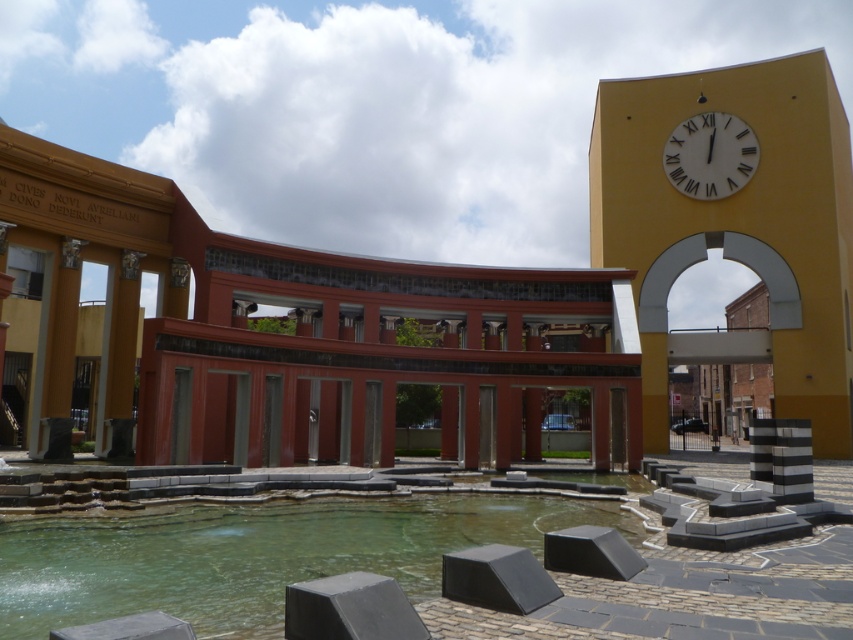
Which is more to the left, yellow matte clock tower at upper right or white matte clock at upper right?

Positioned to the left is white matte clock at upper right.

How far apart are yellow matte clock tower at upper right and white matte clock at upper right?

The distance of yellow matte clock tower at upper right from white matte clock at upper right is 8.74 feet.

What do you see at coordinates (734, 224) in the screenshot? I see `yellow matte clock tower at upper right` at bounding box center [734, 224].

Where is `yellow matte clock tower at upper right`? The width and height of the screenshot is (853, 640). yellow matte clock tower at upper right is located at coordinates (734, 224).

At what (x,y) coordinates should I click in order to perform the action: click on clear glass water at center. Please return your answer as a coordinate pair (x, y). Looking at the image, I should click on (253, 554).

Between clear glass water at center and white matte clock at upper right, which one appears on the right side from the viewer's perspective?

white matte clock at upper right is more to the right.

Who is more distant from viewer, (186, 560) or (666, 145)?

The point (666, 145) is behind.

This screenshot has width=853, height=640. Identify the location of clear glass water at center. (253, 554).

Between yellow matte clock tower at upper right and clear glass water at center, which one appears on the left side from the viewer's perspective?

clear glass water at center is more to the left.

Is yellow matte clock tower at upper right shorter than clear glass water at center?

No, yellow matte clock tower at upper right is not shorter than clear glass water at center.

Which is behind, point (766, 92) or point (415, 589)?

The point (766, 92) is behind.

This screenshot has width=853, height=640. Find the location of `yellow matte clock tower at upper right`. yellow matte clock tower at upper right is located at coordinates (734, 224).